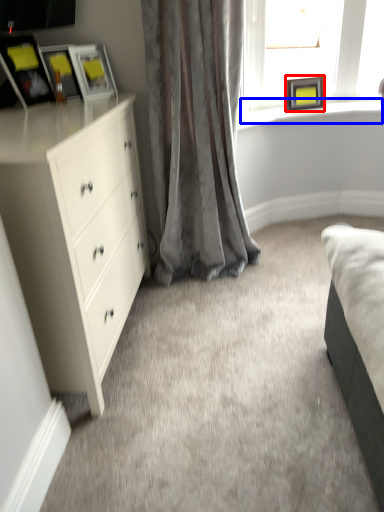
Question: Among these objects, which one is nearest to the camera, picture frame (highlighted by a red box) or window sill (highlighted by a blue box)?

Choices:
 (A) picture frame
 (B) window sill

Answer: (A)